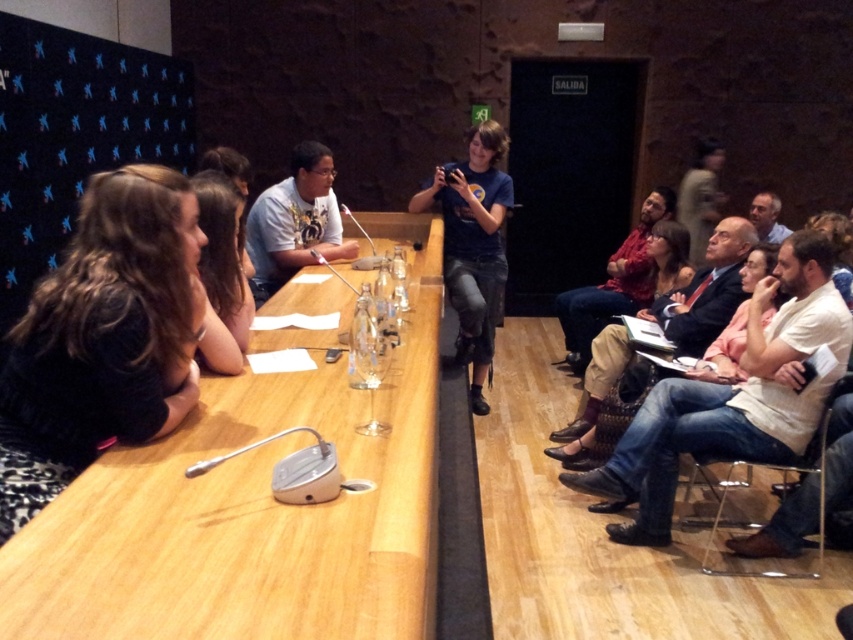
You are a photographer positioned at the back of the conference room. You need to take a photo of both the white cotton shirt at right and the red shirt at right. Which shirt should you focus on first to ensure both are in frame?

You should focus on the red shirt at right first because it occupies more space than the white cotton shirt at right, ensuring both are captured in the frame.

You are standing at the center of the room and want to hand a document to the person wearing the white cotton shirt at right. Which direction should you move to reach them?

The white cotton shirt at right is located at coordinates approximately 0.623 on the x axis and 0.857 on the y axis. Since you are at the center, moving towards the right and slightly forward would lead you to the white cotton shirt at right.